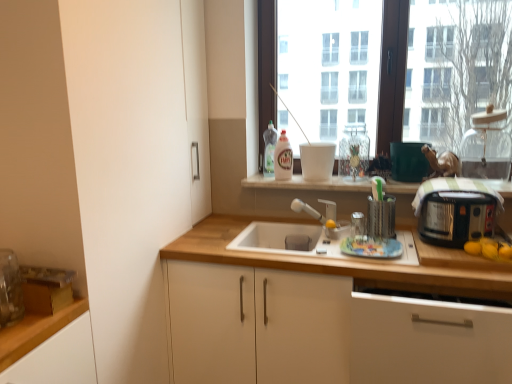
Image resolution: width=512 pixels, height=384 pixels. What do you see at coordinates (308, 183) in the screenshot?
I see `white matte countertop at center` at bounding box center [308, 183].

I want to click on white matte countertop at center, so click(x=308, y=183).

Image resolution: width=512 pixels, height=384 pixels. Identify the location of white glossy bottle at center, the first bottle viewed from the front. (283, 158).

What do you see at coordinates (428, 341) in the screenshot? I see `white matte cabinet at lower right, which is the first cabinetry from right to left` at bounding box center [428, 341].

The image size is (512, 384). What do you see at coordinates (317, 161) in the screenshot?
I see `white matte bowl at upper center, placed as the first appliance when sorted from left to right` at bounding box center [317, 161].

Find the location of a particular element. This screenshot has height=384, width=512. white matte countertop at center is located at coordinates (308, 183).

Is the depth of white matte cabinet at center, the first cabinetry positioned from the left, less than that of white matte bowl at upper center, which is counted as the fifth appliance, starting from the right?

Yes, white matte cabinet at center, the first cabinetry positioned from the left, is closer to the camera.

From the image's perspective, is white matte cabinet at center, the first cabinetry positioned from the left, located beneath white matte bowl at upper center, placed as the first appliance when sorted from left to right?

Correct, white matte cabinet at center, the first cabinetry positioned from the left, appears lower than white matte bowl at upper center, placed as the first appliance when sorted from left to right, in the image.

Does white matte cabinet at lower right, the 2th cabinetry when ordered from left to right, have a larger size compared to matte silver faucet at center?

Indeed, white matte cabinet at lower right, the 2th cabinetry when ordered from left to right, has a larger size compared to matte silver faucet at center.

What's the angular difference between white matte cabinet at lower right, which is the first cabinetry from right to left, and matte silver faucet at center's facing directions?

The angle between the facing direction of white matte cabinet at lower right, which is the first cabinetry from right to left, and the facing direction of matte silver faucet at center is 0.444 degrees.

From the image's perspective, which one is positioned higher, white matte cabinet at lower right, which is the first cabinetry from right to left, or matte silver faucet at center?

matte silver faucet at center appears higher in the image.

From a real-world perspective, count 2nd cabinetrys downward from the matte silver faucet at center and point to it. Please provide its 2D coordinates.

[(428, 341)]

Is the surface of white matte cabinet at center, marked as the second cabinetry in a right-to-left arrangement, in direct contact with translucent plastic bottle at upper center, the second bottle from the front?

No.

Is translucent plastic bottle at upper center, the second bottle from the front, located within white matte cabinet at center, the first cabinetry positioned from the left?

That's incorrect, translucent plastic bottle at upper center, the second bottle from the front, is not inside white matte cabinet at center, the first cabinetry positioned from the left.

Considering the sizes of objects white matte cabinet at center, marked as the second cabinetry in a right-to-left arrangement, and translucent plastic bottle at upper center, arranged as the 1th bottle when viewed from the back, in the image provided, who is thinner, white matte cabinet at center, marked as the second cabinetry in a right-to-left arrangement, or translucent plastic bottle at upper center, arranged as the 1th bottle when viewed from the back,?

With smaller width is translucent plastic bottle at upper center, arranged as the 1th bottle when viewed from the back.

Is white matte cabinet at center, the first cabinetry positioned from the left, looking in the opposite direction of translucent plastic bottle at upper center, arranged as the 1th bottle when viewed from the back?

white matte cabinet at center, the first cabinetry positioned from the left, is not turned away from translucent plastic bottle at upper center, arranged as the 1th bottle when viewed from the back.

From a real-world perspective, is matte silver faucet at center positioned under translucent plastic bottle at upper center, the second bottle from the front, based on gravity?

Indeed, from a real-world perspective, matte silver faucet at center is positioned beneath translucent plastic bottle at upper center, the second bottle from the front.

From the image's perspective, is matte silver faucet at center located beneath translucent plastic bottle at upper center, the second bottle from the front?

Yes, from the image's perspective, matte silver faucet at center is beneath translucent plastic bottle at upper center, the second bottle from the front.

Who is more distant, matte silver faucet at center or translucent plastic bottle at upper center, arranged as the 1th bottle when viewed from the back?

Positioned behind is translucent plastic bottle at upper center, arranged as the 1th bottle when viewed from the back.

Is matte silver faucet at center oriented towards translucent plastic bottle at upper center, the second bottle from the front?

No, matte silver faucet at center is not turned towards translucent plastic bottle at upper center, the second bottle from the front.

Does transparent glass jar at upper right, which is counted as the 5th appliance, starting from the left, lie in front of black plastic toaster at right, the 2th appliance when ordered from right to left?

No, transparent glass jar at upper right, which is counted as the 5th appliance, starting from the left, is further to the viewer.

Does transparent glass jar at upper right, arranged as the first appliance when viewed from the right, have a greater height compared to black plastic toaster at right, acting as the 4th appliance starting from the left?

Yes.

Is transparent glass jar at upper right, which is counted as the 5th appliance, starting from the left, aimed at black plastic toaster at right, the 2th appliance when ordered from right to left?

No, transparent glass jar at upper right, which is counted as the 5th appliance, starting from the left, does not turn towards black plastic toaster at right, the 2th appliance when ordered from right to left.

How far apart are transparent glass jar at upper right, which is counted as the 5th appliance, starting from the left, and black plastic toaster at right, acting as the 4th appliance starting from the left?

transparent glass jar at upper right, which is counted as the 5th appliance, starting from the left, is 21.36 inches from black plastic toaster at right, acting as the 4th appliance starting from the left.

Is white glossy bottle at center, positioned as the second bottle in back-to-front order, inside the boundaries of matte silver faucet at center, or outside?

white glossy bottle at center, positioned as the second bottle in back-to-front order, cannot be found inside matte silver faucet at center.

Is the position of white glossy bottle at center, the first bottle viewed from the front, more distant than that of matte silver faucet at center?

Yes, white glossy bottle at center, the first bottle viewed from the front, is further from the viewer.

Does white glossy bottle at center, positioned as the second bottle in back-to-front order, turn towards matte silver faucet at center?

No, white glossy bottle at center, positioned as the second bottle in back-to-front order, does not turn towards matte silver faucet at center.

Is point (282, 178) positioned after point (298, 207)?

Yes, it is.

Based on the photo, how distant is white matte bowl at upper center, which is counted as the fifth appliance, starting from the right, from white matte cabinet at center, marked as the second cabinetry in a right-to-left arrangement?

84.44 centimeters.

Does white matte bowl at upper center, which is counted as the fifth appliance, starting from the right, turn towards white matte cabinet at center, marked as the second cabinetry in a right-to-left arrangement?

No, white matte bowl at upper center, which is counted as the fifth appliance, starting from the right, is not facing towards white matte cabinet at center, marked as the second cabinetry in a right-to-left arrangement.

Considering the sizes of objects white matte bowl at upper center, placed as the first appliance when sorted from left to right, and white matte cabinet at center, the first cabinetry positioned from the left, in the image provided, who is thinner, white matte bowl at upper center, placed as the first appliance when sorted from left to right, or white matte cabinet at center, the first cabinetry positioned from the left,?

With smaller width is white matte bowl at upper center, placed as the first appliance when sorted from left to right.

This screenshot has width=512, height=384. In order to click on the 1st cabinetry to the right of the white matte bowl at upper center, which is counted as the fifth appliance, starting from the right, counting from the anchor's position in this screenshot , I will do point(322,318).

Locate an element on the screen. The image size is (512, 384). appliance that is on the left side of white matte cabinet at center, the first cabinetry positioned from the left is located at coordinates (317, 161).

Locate an element on the screen. The width and height of the screenshot is (512, 384). faucet behind the white matte cabinet at lower right, which is the first cabinetry from right to left is located at coordinates (312, 213).

Looking at the image, which one is located further to black plastic toaster at right, acting as the 4th appliance starting from the left, translucent plastic bottle at upper center, the second bottle from the front, or white glossy bottle at center, positioned as the second bottle in back-to-front order?

Among the two, translucent plastic bottle at upper center, the second bottle from the front, is located further to black plastic toaster at right, acting as the 4th appliance starting from the left.

Based on their spatial positions, is white matte cabinet at lower right, which is the first cabinetry from right to left, or translucent plastic bottle at upper center, arranged as the 1th bottle when viewed from the back, further from matte silver faucet at center?

Based on the image, white matte cabinet at lower right, which is the first cabinetry from right to left, appears to be further to matte silver faucet at center.

Looking at this image, considering their positions, is clear plastic utensil holder at upper right, arranged as the second appliance when viewed from the left, positioned further to white matte cabinet at lower right, which is the first cabinetry from right to left, than transparent glass jar at upper right, arranged as the first appliance when viewed from the right?

transparent glass jar at upper right, arranged as the first appliance when viewed from the right, is further to white matte cabinet at lower right, which is the first cabinetry from right to left.

Considering their positions, is matte silver faucet at center positioned further to white matte bowl at upper center, which is counted as the fifth appliance, starting from the right, than black plastic toaster at right, the 2th appliance when ordered from right to left?

Among the two, black plastic toaster at right, the 2th appliance when ordered from right to left, is located further to white matte bowl at upper center, which is counted as the fifth appliance, starting from the right.

When comparing their distances from white matte cabinet at lower right, the 2th cabinetry when ordered from left to right, does white matte bowl at upper center, placed as the first appliance when sorted from left to right, or translucent plastic bottle at upper center, arranged as the 1th bottle when viewed from the back, seem closer?

Among the two, white matte bowl at upper center, placed as the first appliance when sorted from left to right, is located nearer to white matte cabinet at lower right, the 2th cabinetry when ordered from left to right.

Considering their positions, is clear plastic utensil holder at upper right, the 4th appliance when ordered from right to left, positioned closer to white matte bowl at upper center, which is counted as the fifth appliance, starting from the right, than white matte cabinet at center, marked as the second cabinetry in a right-to-left arrangement?

clear plastic utensil holder at upper right, the 4th appliance when ordered from right to left, lies closer to white matte bowl at upper center, which is counted as the fifth appliance, starting from the right, than the other object.

When comparing their distances from white matte bowl at upper center, placed as the first appliance when sorted from left to right, does white matte cabinet at center, marked as the second cabinetry in a right-to-left arrangement, or black plastic toaster at right, acting as the 4th appliance starting from the left, seem closer?

black plastic toaster at right, acting as the 4th appliance starting from the left.

Which object lies further to the anchor point black plastic toaster at right, the 2th appliance when ordered from right to left, clear plastic utensil holder at upper right, arranged as the second appliance when viewed from the left, or white matte bowl at upper center, placed as the first appliance when sorted from left to right?

white matte bowl at upper center, placed as the first appliance when sorted from left to right.

Where is `bottle located between translucent plastic bottle at upper center, the second bottle from the front, and transparent glass window at center in the left-right direction`? The height and width of the screenshot is (384, 512). bottle located between translucent plastic bottle at upper center, the second bottle from the front, and transparent glass window at center in the left-right direction is located at coordinates (283, 158).

I want to click on window between translucent plastic bottle at upper center, arranged as the 1th bottle when viewed from the back, and green matte pot at upper right, marked as the 3th appliance in a right-to-left arrangement, from left to right, so click(x=445, y=70).

Locate an element on the screen. appliance that lies between clear plastic utensil holder at upper right, arranged as the second appliance when viewed from the left, and white matte cabinet at lower right, which is the first cabinetry from right to left, from top to bottom is located at coordinates (456, 217).

Find the location of `countertop situated between translucent plastic bottle at upper center, the second bottle from the front, and transparent glass window at center from left to right`. countertop situated between translucent plastic bottle at upper center, the second bottle from the front, and transparent glass window at center from left to right is located at coordinates (308, 183).